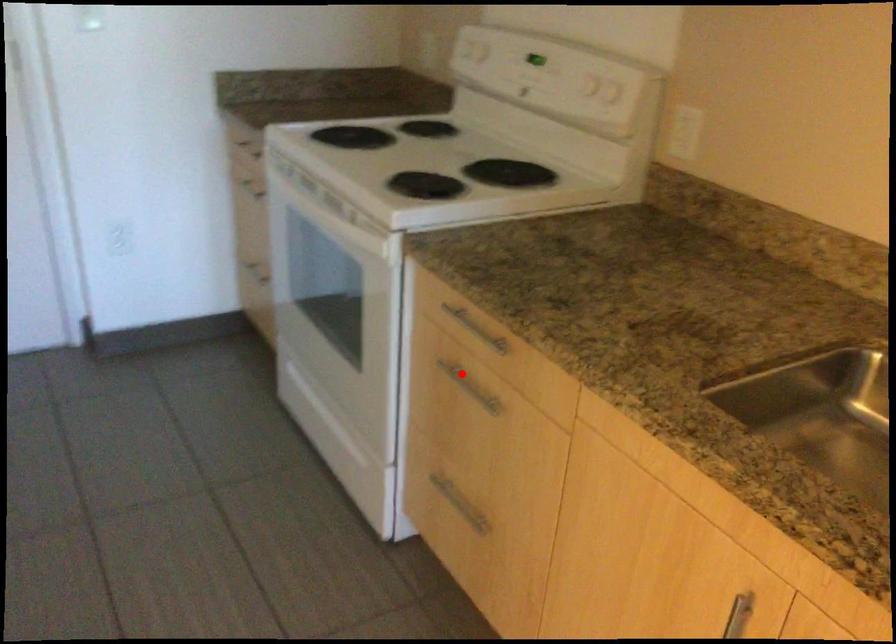
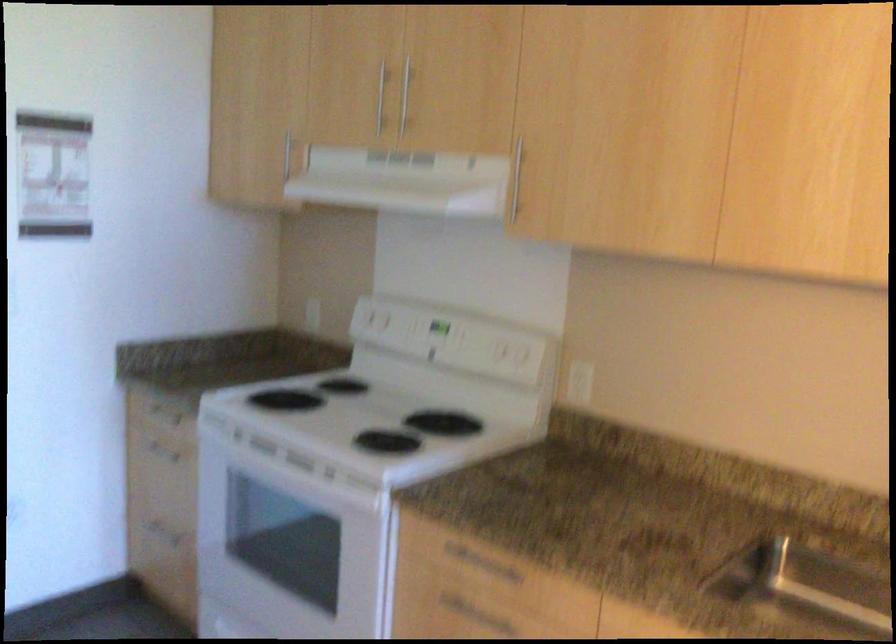
The point at the highlighted location is marked in the first image. Where is the corresponding point in the second image?

(466, 609)